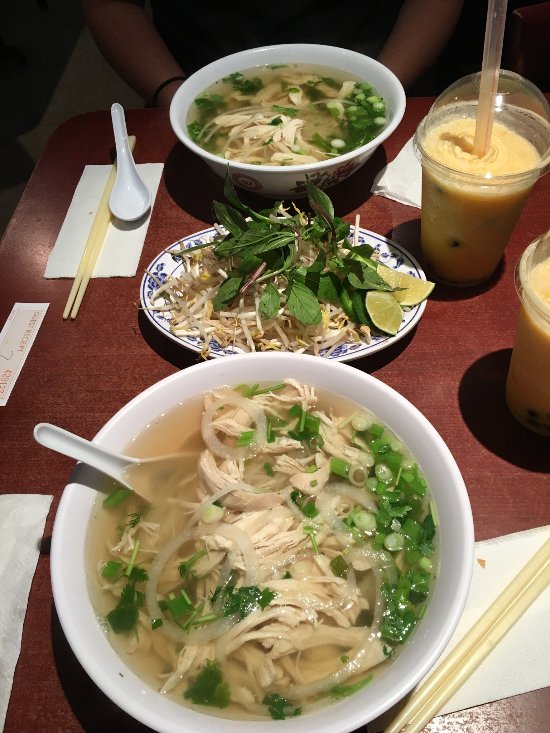
This screenshot has width=550, height=733. Identify the location of napkins. (14, 537), (82, 185), (403, 171).